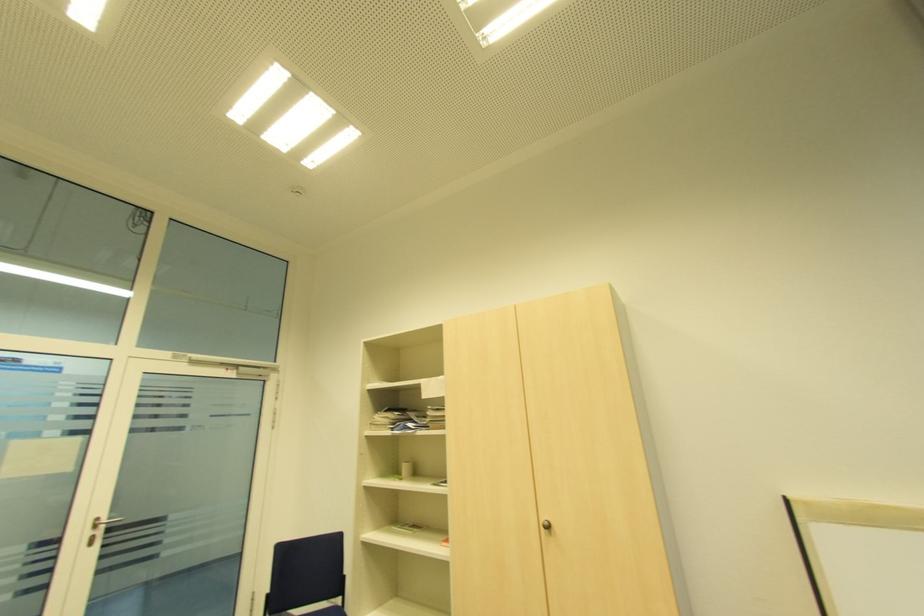
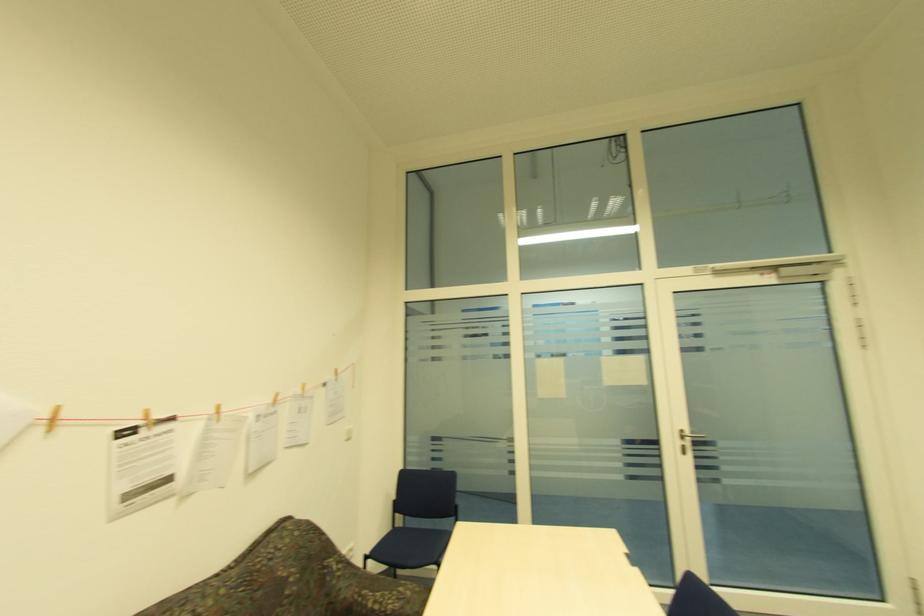
Find the pixel in the second image that matches point (99, 519) in the first image.

(685, 432)